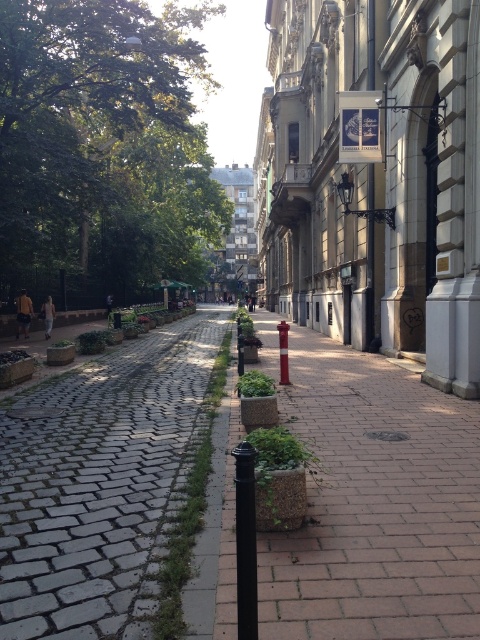
Question: Does gray cobblestone pavement at left appear on the right side of black matte pole at center?

Choices:
 (A) yes
 (B) no

Answer: (B)

Question: Does black matte pole at center have a lesser width compared to red plastic fire hydrant at center?

Choices:
 (A) no
 (B) yes

Answer: (B)

Question: Is gray cobblestone pavement at left bigger than red plastic fire hydrant at center?

Choices:
 (A) yes
 (B) no

Answer: (A)

Question: Which point is farther from the camera taking this photo?

Choices:
 (A) (323, 429)
 (B) (283, 358)
 (C) (32, 486)
 (D) (240, 484)

Answer: (B)

Question: Among these points, which one is farthest from the camera?

Choices:
 (A) [x=132, y=592]
 (B) [x=369, y=403]
 (C) [x=280, y=381]
 (D) [x=247, y=444]

Answer: (C)

Question: Which object is the farthest from the black matte pole at center?

Choices:
 (A) red plastic fire hydrant at center
 (B) brick pavement at center

Answer: (A)